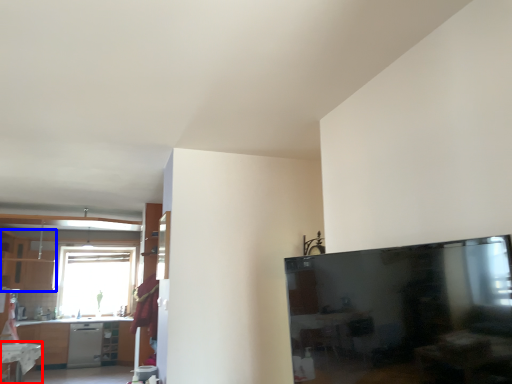
Question: Which point is closer to the camera, table (highlighted by a red box) or cabinetry (highlighted by a blue box)?

Choices:
 (A) table
 (B) cabinetry

Answer: (A)